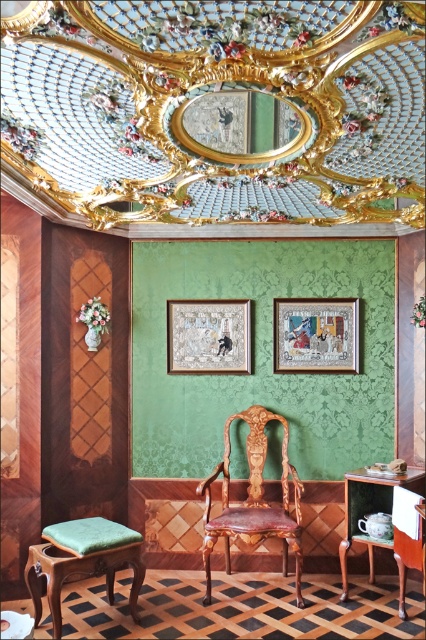
You are standing in the room and want to move from the green velvet stool at lower left to the polished wood armchair at center. Which direction should you move to get closer to the armchair?

You should move forward towards the polished wood armchair at center because it is closer to you than the green velvet stool at lower left.

You are an interior designer assessing the placement of items in this ornate room. The wooden framed picture at center and the porcelain teacup at lower right are both in view. Which object has a greater height?

The porcelain teacup at lower right is taller than the wooden framed picture at center, so the porcelain teacup at lower right has a greater height.